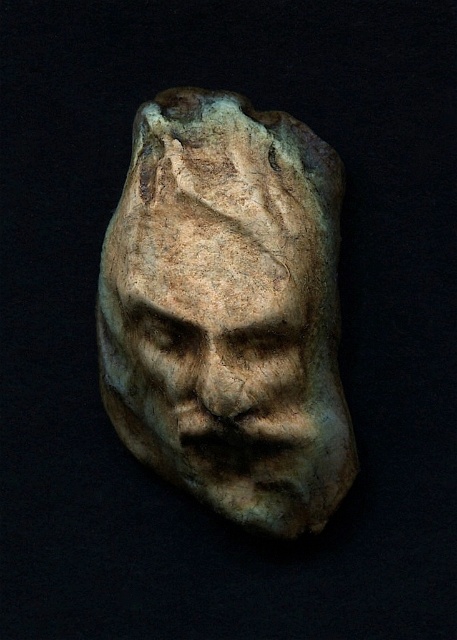
You are an art conservator examining the sculpture. You notice two points on the sculpture labeled as point 1 at coordinates [111,372] and point 2 at coordinates [175,433]. Which point is closer to you when you are standing in front of the sculpture?

Point 1 at coordinates [111,372] is closer to you because it is further to the viewer than point 2 at coordinates [175,433].

You are standing 1.5 meters away from a sculpture. A point on the sculpture at coordinates point (308, 374) is mentioned. Is this point closer to you than your current distance?

The distance of point (308, 374) from camera is 1.33 meters, so yes, the point is closer to you than your current distance of 1.5 meters.

You are an art conservator examining the sculpture. You notice two distinct areas on the sculpture labeled as the matte stone face at center and the rough stone face at center. Which area is located higher up on the sculpture?

The matte stone face at center is positioned over the rough stone face at center, so the matte stone face at center is higher up on the sculpture.